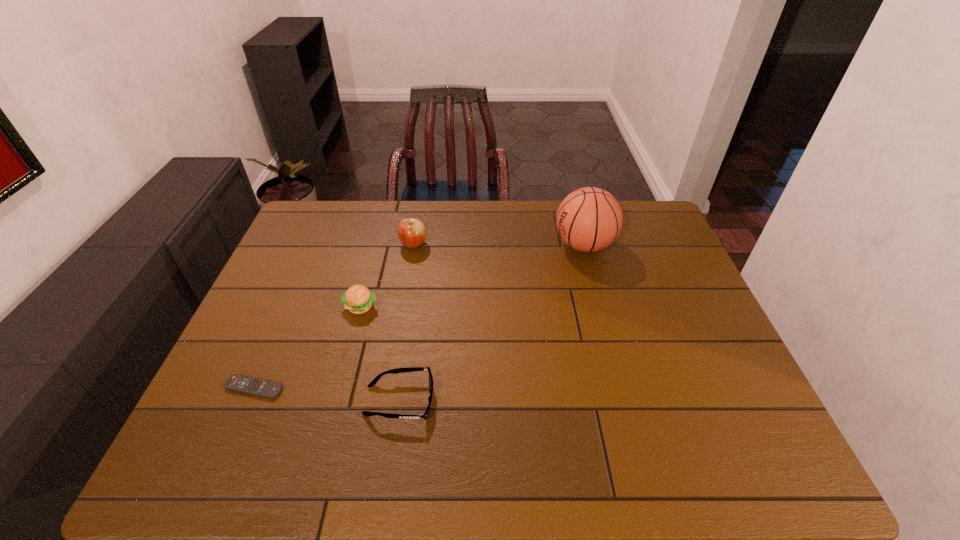
Where is `the rightmost object`? the rightmost object is located at coordinates (589, 219).

Where is `the tallest object`? The width and height of the screenshot is (960, 540). the tallest object is located at coordinates (589, 219).

Image resolution: width=960 pixels, height=540 pixels. In order to click on the fourth shortest object in this screenshot , I will do `click(412, 233)`.

Locate an element on the screen. the fourth object from right to left is located at coordinates (358, 299).

The image size is (960, 540). Find the location of `the third shortest object`. the third shortest object is located at coordinates (358, 299).

At what (x,y) coordinates should I click in order to perform the action: click on sunglasses. Please return your answer as a coordinate pair (x, y). Image resolution: width=960 pixels, height=540 pixels. Looking at the image, I should click on (399, 370).

Identify the location of remote control. The width and height of the screenshot is (960, 540). (238, 383).

Find the location of a particular element. Image resolution: width=960 pixels, height=540 pixels. the leftmost object is located at coordinates (238, 383).

Find the location of `vacant position located 0.380m on the surface of the tallest object near the brand logo`. vacant position located 0.380m on the surface of the tallest object near the brand logo is located at coordinates (438, 245).

This screenshot has height=540, width=960. I want to click on vacant space located on the surface of the tallest object near the brand logo, so click(x=462, y=245).